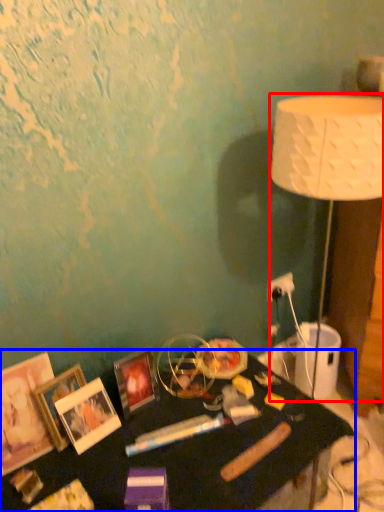
Question: Which of the following is the closest to the observer, lamp (highlighted by a red box) or table (highlighted by a blue box)?

Choices:
 (A) lamp
 (B) table

Answer: (B)